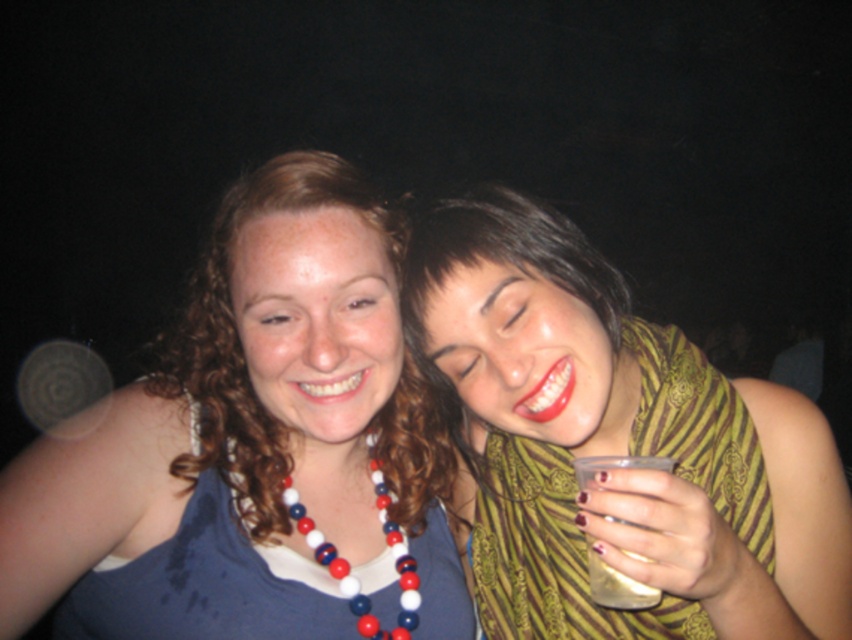
You are a GUI agent. You are given a task and a screenshot of the screen. Output one action in this format:
    pyautogui.click(x=<x>, y=<y>)
    Task: Click on the green striped scarf at right
    
    Given the screenshot: What is the action you would take?
    pyautogui.click(x=617, y=444)

Does green striped scarf at right have a lesser height compared to red and white beads at center?

In fact, green striped scarf at right may be taller than red and white beads at center.

At what (x,y) coordinates should I click in order to perform the action: click on green striped scarf at right. Please return your answer as a coordinate pair (x, y). Image resolution: width=852 pixels, height=640 pixels. Looking at the image, I should click on (617, 444).

Is matte blue tank top at center bigger than red and white beads at center?

Yes.

How far apart are matte blue tank top at center and red and white beads at center?

matte blue tank top at center and red and white beads at center are 4.63 inches apart from each other.

Between point (318, 273) and point (387, 532), which one is positioned behind?

The point (387, 532) is behind.

Locate an element on the screen. The image size is (852, 640). matte blue tank top at center is located at coordinates tap(254, 449).

Is point (323, 476) closer to camera compared to point (475, 465)?

Yes, point (323, 476) is closer to viewer.

Who is more forward, (275,349) or (816,417)?

Point (275,349) is more forward.

At what (x,y) coordinates should I click in order to perform the action: click on matte blue tank top at center. Please return your answer as a coordinate pair (x, y). This screenshot has width=852, height=640. Looking at the image, I should click on (254, 449).